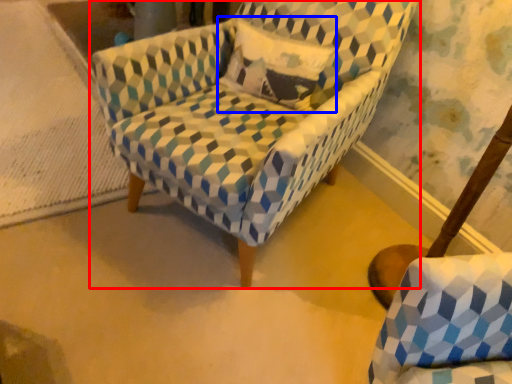
Question: Among these objects, which one is farthest to the camera, chair (highlighted by a red box) or throw pillow (highlighted by a blue box)?

Choices:
 (A) chair
 (B) throw pillow

Answer: (B)